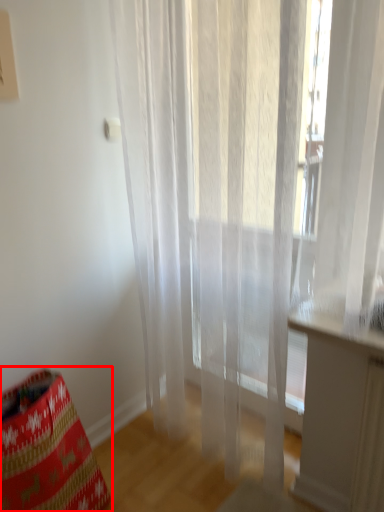
Question: Where is bean bag chair (annotated by the red box) located in relation to curtain in the image?

Choices:
 (A) right
 (B) left

Answer: (B)